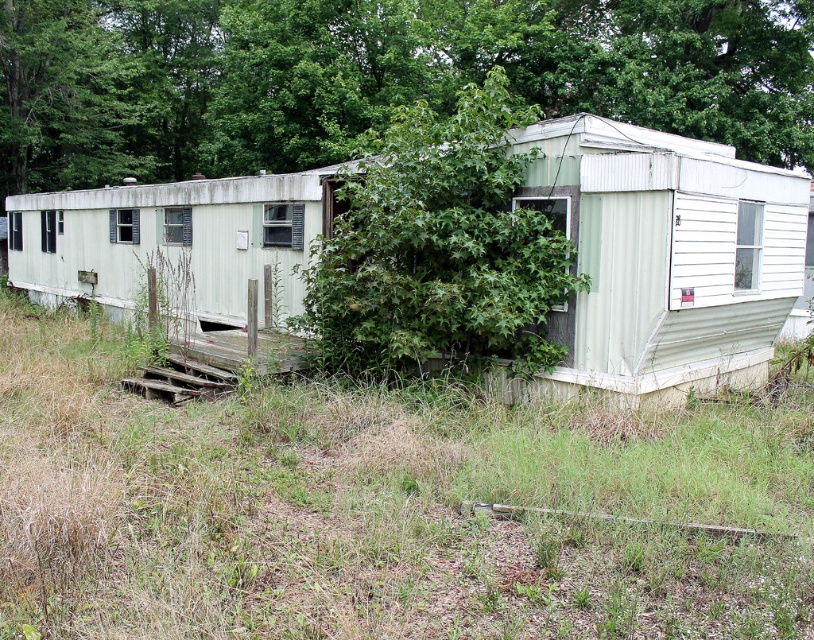
Question: Does green grass at lower center have a lesser width compared to green leafy tree at upper center?

Choices:
 (A) yes
 (B) no

Answer: (A)

Question: Which point appears closest to the camera in this image?

Choices:
 (A) (31, 228)
 (B) (532, 288)

Answer: (B)

Question: Which of the following is the closest to the observer?

Choices:
 (A) (419, 188)
 (B) (803, 216)

Answer: (A)

Question: Which is nearer to the green grass at lower center?

Choices:
 (A) green leafy tree at upper center
 (B) green corrugated metal mobile home at center
 (C) green leafy tree at center

Answer: (C)

Question: Is green grass at lower center below green leafy tree at upper center?

Choices:
 (A) no
 (B) yes

Answer: (B)

Question: Is green grass at lower center positioned in front of green leafy tree at center?

Choices:
 (A) yes
 (B) no

Answer: (A)